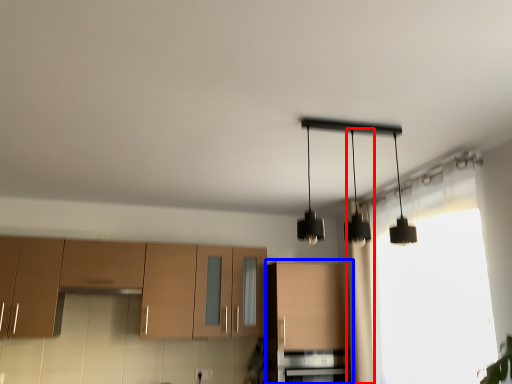
Question: Among these objects, which one is nearest to the camera, curtain (highlighted by a red box) or cabinetry (highlighted by a blue box)?

Choices:
 (A) curtain
 (B) cabinetry

Answer: (A)